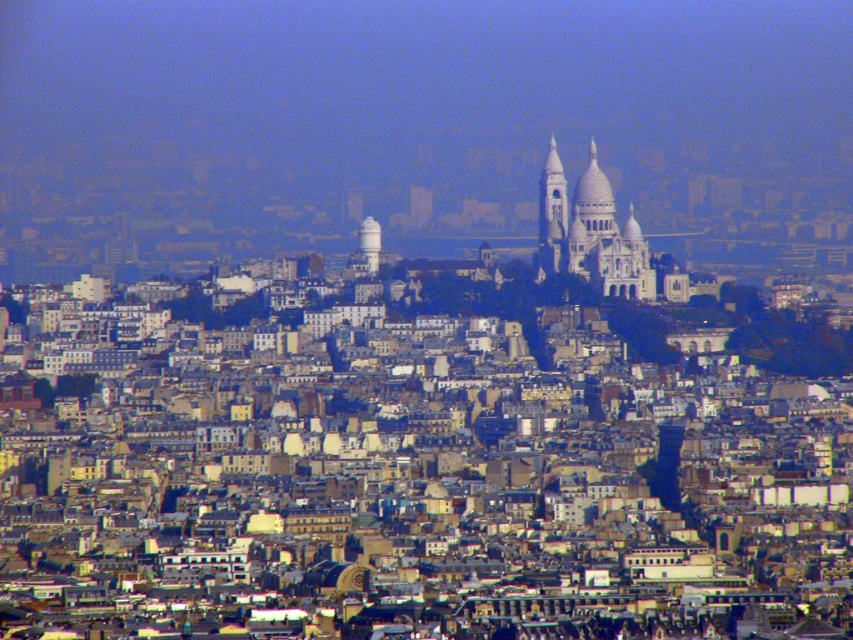
Is white stone church at center above smooth white tower at center?

Indeed, white stone church at center is positioned over smooth white tower at center.

Which is behind, point (541, 179) or point (367, 259)?

Point (541, 179)

Locate an element on the screen. This screenshot has width=853, height=640. white stone church at center is located at coordinates (590, 232).

The height and width of the screenshot is (640, 853). I want to click on white stone church at center, so click(590, 232).